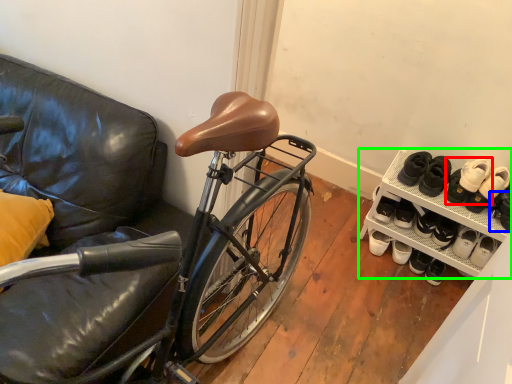
Question: Estimate the real-world distances between objects in this image. Which object is closer to footwear (highlighted by a red box), shoe (highlighted by a blue box) or cabinetry (highlighted by a green box)?

Choices:
 (A) shoe
 (B) cabinetry

Answer: (A)